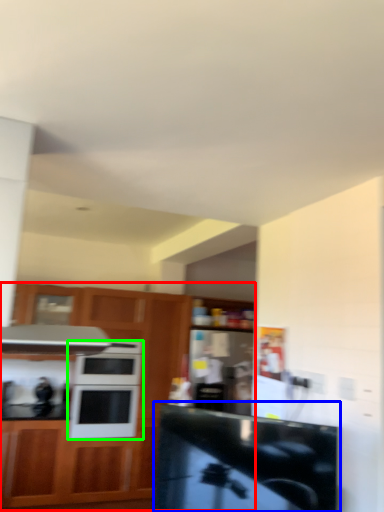
Question: Considering the real-world distances, which object is farthest from cabinetry (highlighted by a red box)? counter top (highlighted by a blue box) or microwave oven (highlighted by a green box)?

Choices:
 (A) counter top
 (B) microwave oven

Answer: (A)